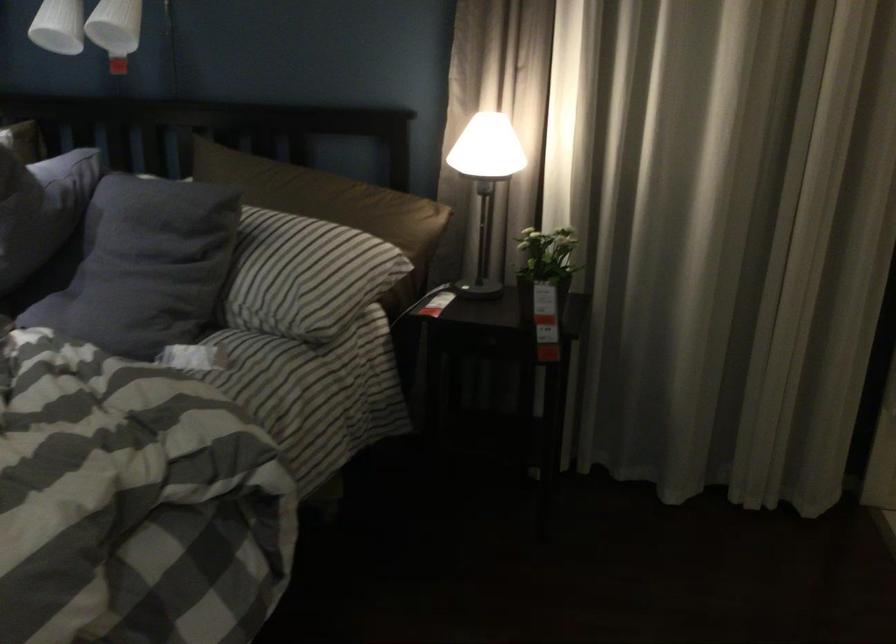
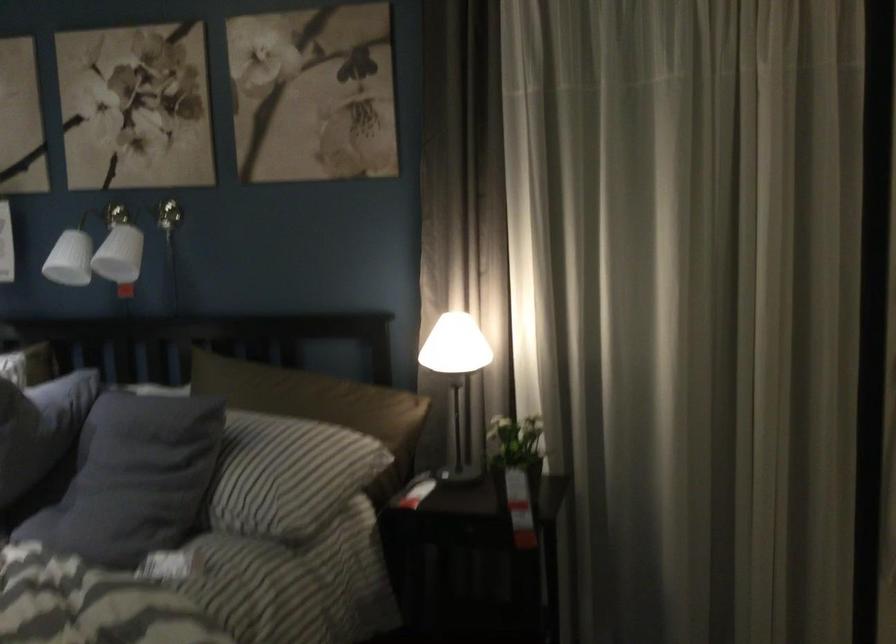
The point at (x=297, y=270) is marked in the first image. Where is the corresponding point in the second image?

(280, 471)